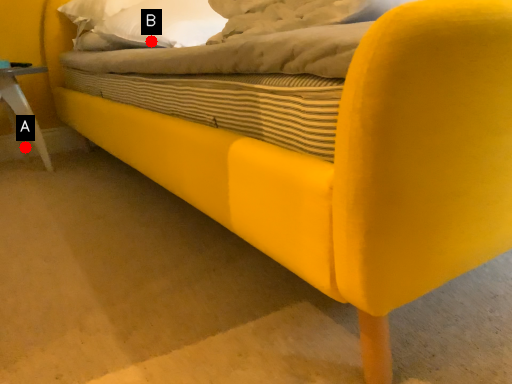
Question: Two points are circled on the image, labeled by A and B beside each circle. Which point appears closest to the camera in this image?

Choices:
 (A) A is closer
 (B) B is closer

Answer: (B)